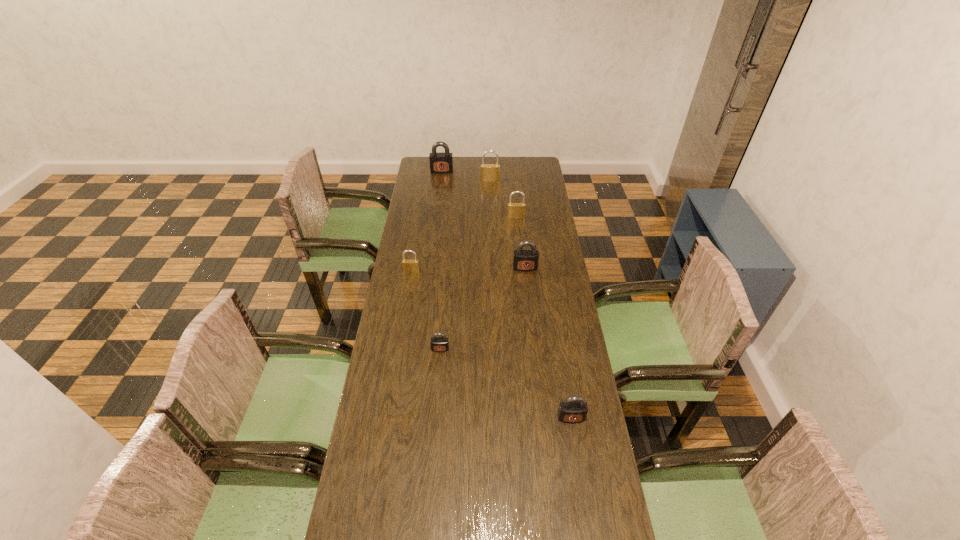
The width and height of the screenshot is (960, 540). In order to click on vacant area situated 0.070m on the front of the second nearest padlock near the keyhole in this screenshot , I will do `click(439, 369)`.

Image resolution: width=960 pixels, height=540 pixels. Find the location of `object at the far left corner`. object at the far left corner is located at coordinates (442, 162).

The height and width of the screenshot is (540, 960). Find the location of `vacant space at the far edge`. vacant space at the far edge is located at coordinates (462, 157).

Image resolution: width=960 pixels, height=540 pixels. Find the location of `vacant space at the left edge of the desktop`. vacant space at the left edge of the desktop is located at coordinates (432, 252).

At what (x,y) coordinates should I click in order to perform the action: click on free space at the right edge. Please return your answer as a coordinate pair (x, y). This screenshot has height=540, width=960. Looking at the image, I should click on (554, 359).

Where is `free space between the fourth padlock from left to right and the second farthest gray padlock`? The image size is (960, 540). free space between the fourth padlock from left to right and the second farthest gray padlock is located at coordinates (508, 224).

Where is `vacant area that lies between the second brass padlock from right to left and the second nearest padlock`? vacant area that lies between the second brass padlock from right to left and the second nearest padlock is located at coordinates (466, 265).

Locate an element on the screen. free area in between the farthest object and the rightmost brass padlock is located at coordinates (479, 194).

Image resolution: width=960 pixels, height=540 pixels. I want to click on free area in between the biggest gray padlock and the nearest padlock, so click(x=506, y=294).

Image resolution: width=960 pixels, height=540 pixels. What are the coordinates of `free area in between the farthest padlock and the sixth nearest object` in the screenshot? It's located at (466, 176).